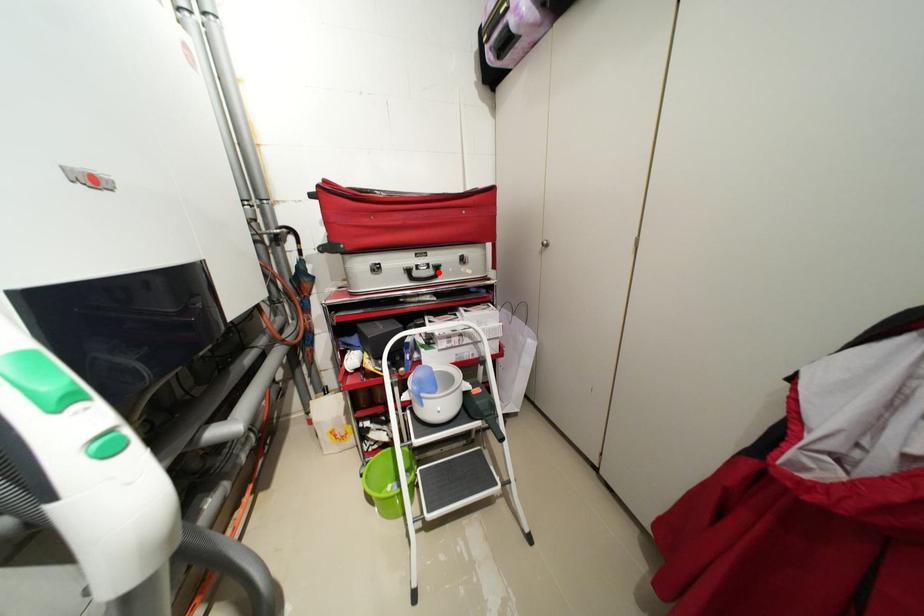
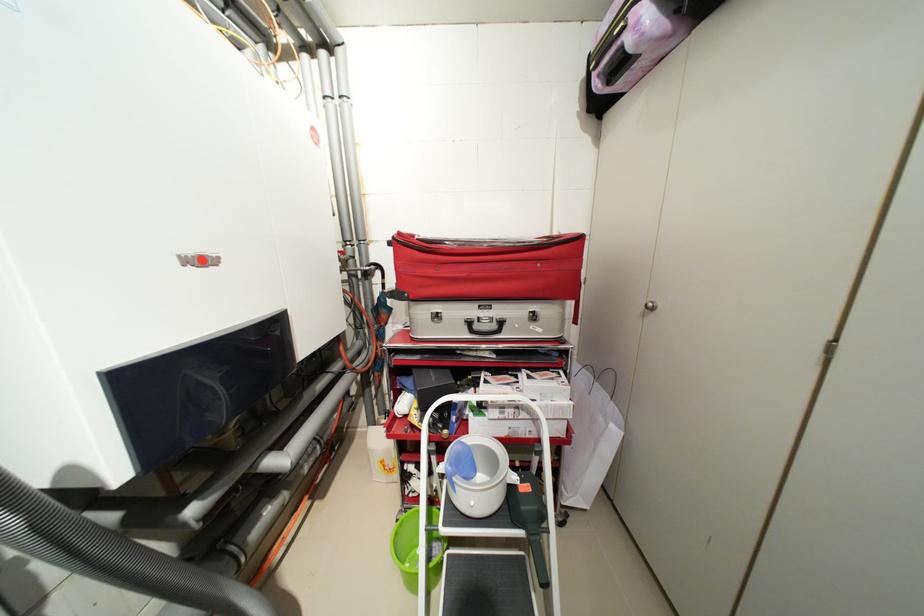
Locate, in the second image, the point that corresponds to the highlighted location in the first image.

(502, 326)